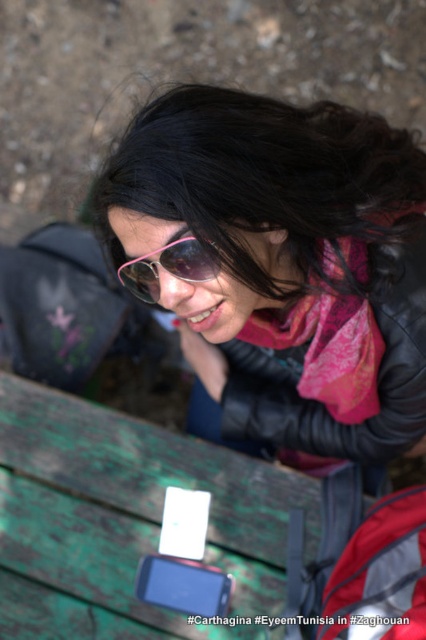
You are a fashion designer observing the person in the image. You need to determine which item of clothing or accessory is bigger between the matte black jacket at center and the pink reflective sunglasses at center. Which one is larger?

The matte black jacket at center is larger than the pink reflective sunglasses at center.

You are a fashion designer observing the person in the image. You want to create a new outfit that includes both the matte black jacket at center and the pink reflective sunglasses at center. Based on their current positions, which item should be placed higher on the body to maintain visual balance?

The matte black jacket at center is much taller than the pink reflective sunglasses at center, so to maintain visual balance, the pink reflective sunglasses at center should be placed higher on the body to balance the vertical proportions.